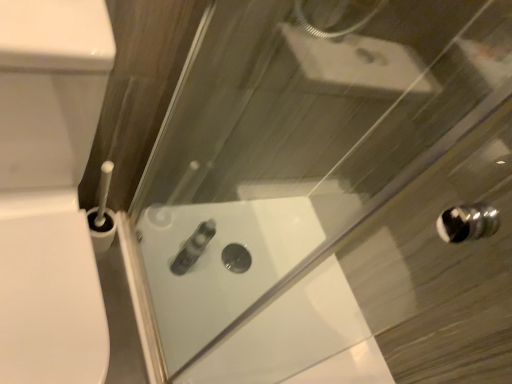
You are a GUI agent. You are given a task and a screenshot of the screen. Output one action in this format:
    pyautogui.click(x=<x>, y=<y>)
    Task: Click on the unoccupied space behind satin silver tube at center
    This screenshot has width=512, height=384.
    Given the screenshot: What is the action you would take?
    pyautogui.click(x=188, y=241)